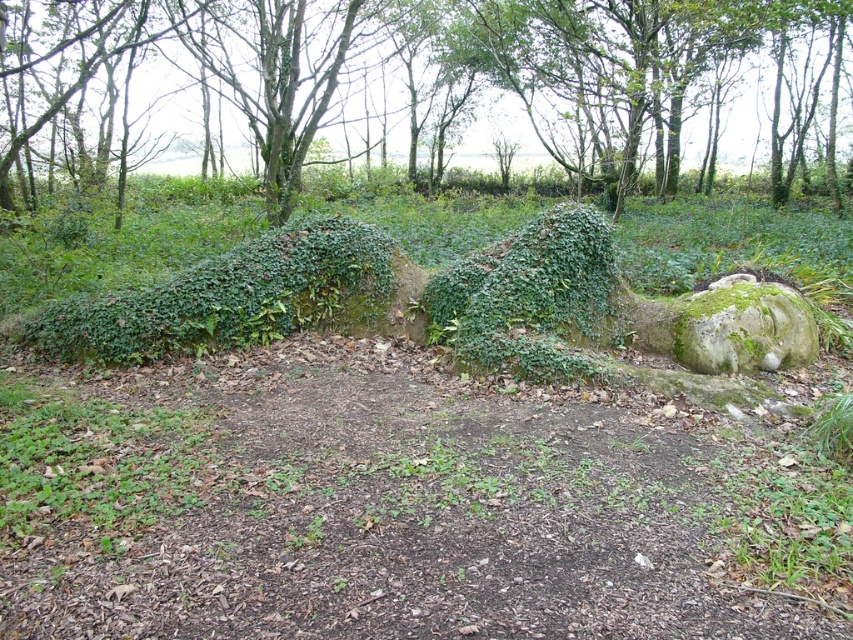
Between green mossy rock at center and green mossy hedge at center, which one has less height?

Standing shorter between the two is green mossy hedge at center.

Who is more forward, (677, 124) or (263, 273)?

Point (263, 273) is in front.

You are a GUI agent. You are given a task and a screenshot of the screen. Output one action in this format:
    pyautogui.click(x=<x>, y=<y>)
    Task: Click on the green mossy rock at center
    The height and width of the screenshot is (640, 853).
    Given the screenshot: What is the action you would take?
    pyautogui.click(x=431, y=86)